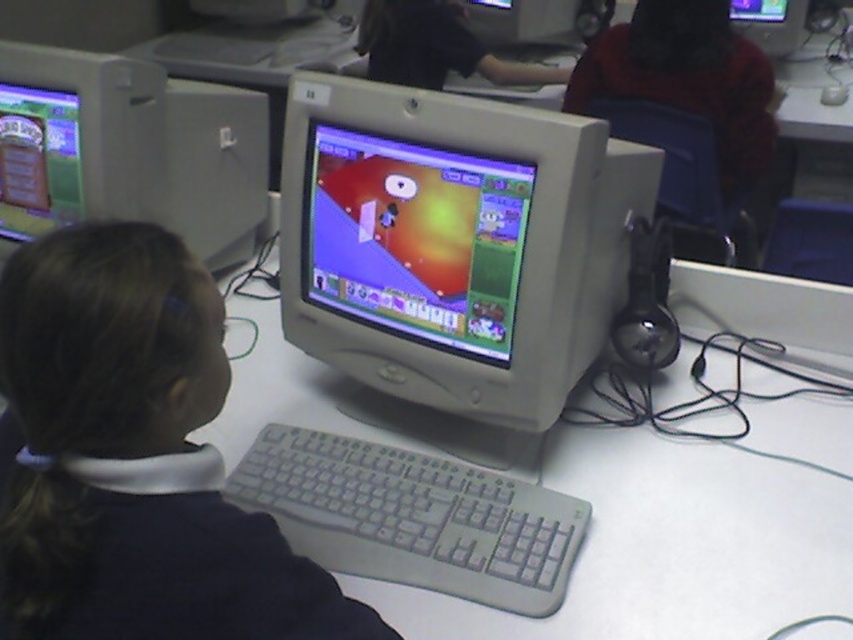
Is matte gray monitor at center thinner than black matte hair at center?

No, matte gray monitor at center is not thinner than black matte hair at center.

Who is positioned more to the left, matte gray monitor at center or black matte hair at center?

black matte hair at center is more to the left.

Who is more forward, (x=367, y=320) or (x=76, y=508)?

Point (x=76, y=508)

The image size is (853, 640). Identify the location of matte gray monitor at center. (453, 256).

Does black matte hair at center have a greater width compared to matte gray monitor at upper center?

Yes.

Does black matte hair at center have a lesser width compared to matte gray monitor at upper center?

No.

Between point (99, 449) and point (763, 19), which one is positioned behind?

The point (763, 19) is behind.

This screenshot has height=640, width=853. Find the location of `black matte hair at center`. black matte hair at center is located at coordinates 158,570.

Is point (30, 550) less distant than point (148, 177)?

Yes, it is.

Does black matte hair at center appear on the right side of matte gray monitor at left?

Indeed, black matte hair at center is positioned on the right side of matte gray monitor at left.

Where is `black matte hair at center`? black matte hair at center is located at coordinates (158, 570).